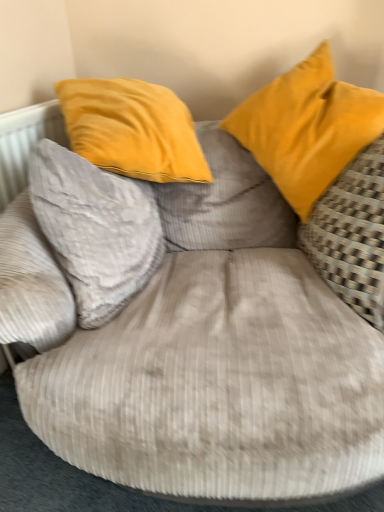
Question: Can you confirm if matte yellow pillow at upper right, which appears as the 2th pillow when viewed from the right, is wider than gray corduroy pillow at left, the 1th pillow in the left-to-right sequence?

Choices:
 (A) yes
 (B) no

Answer: (A)

Question: Is matte yellow pillow at upper right, acting as the 2th pillow starting from the left, not close to gray corduroy pillow at left, the 1th pillow in the left-to-right sequence?

Choices:
 (A) no
 (B) yes

Answer: (A)

Question: Can you confirm if matte yellow pillow at upper right, acting as the 2th pillow starting from the left, is bigger than gray corduroy pillow at left, the 1th pillow in the left-to-right sequence?

Choices:
 (A) no
 (B) yes

Answer: (B)

Question: From the image's perspective, is matte yellow pillow at upper right, acting as the 2th pillow starting from the left, on top of gray corduroy pillow at left, the 1th pillow in the left-to-right sequence?

Choices:
 (A) no
 (B) yes

Answer: (B)

Question: Considering the relative positions of matte yellow pillow at upper right, which appears as the 2th pillow when viewed from the right, and gray corduroy pillow at left, the 1th pillow in the left-to-right sequence, in the image provided, is matte yellow pillow at upper right, which appears as the 2th pillow when viewed from the right, to the right of gray corduroy pillow at left, the 1th pillow in the left-to-right sequence, from the viewer's perspective?

Choices:
 (A) yes
 (B) no

Answer: (A)

Question: From the image's perspective, does matte yellow pillow at upper right, which appears as the 2th pillow when viewed from the right, appear lower than gray corduroy pillow at left, which is the 3th pillow in right-to-left order?

Choices:
 (A) no
 (B) yes

Answer: (A)

Question: Can you confirm if gray corduroy pillow at left, which is the 3th pillow in right-to-left order, is smaller than matte yellow pillow at upper right, acting as the 2th pillow starting from the left?

Choices:
 (A) yes
 (B) no

Answer: (A)

Question: Can you confirm if gray corduroy pillow at left, which is the 3th pillow in right-to-left order, is shorter than matte yellow pillow at upper right, acting as the 2th pillow starting from the left?

Choices:
 (A) yes
 (B) no

Answer: (A)

Question: Can you confirm if gray corduroy pillow at left, the 1th pillow in the left-to-right sequence, is thinner than matte yellow pillow at upper right, which appears as the 2th pillow when viewed from the right?

Choices:
 (A) yes
 (B) no

Answer: (A)

Question: Does gray corduroy pillow at left, which is the 3th pillow in right-to-left order, have a greater width compared to matte yellow pillow at upper right, which appears as the 2th pillow when viewed from the right?

Choices:
 (A) no
 (B) yes

Answer: (A)

Question: Is the position of gray corduroy pillow at left, which is the 3th pillow in right-to-left order, more distant than that of matte yellow pillow at upper right, which appears as the 2th pillow when viewed from the right?

Choices:
 (A) no
 (B) yes

Answer: (A)

Question: Is gray corduroy pillow at left, the 1th pillow in the left-to-right sequence, looking in the opposite direction of matte yellow pillow at upper right, which appears as the 2th pillow when viewed from the right?

Choices:
 (A) no
 (B) yes

Answer: (A)

Question: From the image's perspective, is gray corduroy pillow at left, which is the 3th pillow in right-to-left order, on yellow fabric pillow at right, the 1th pillow viewed from the right?

Choices:
 (A) yes
 (B) no

Answer: (B)